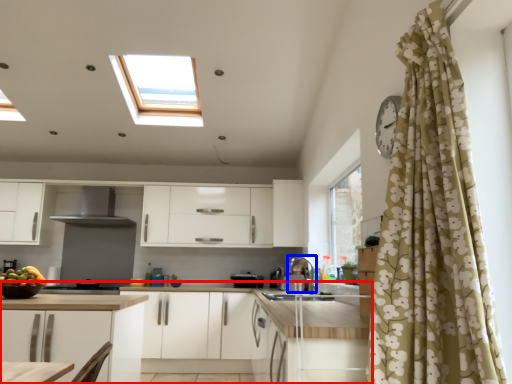
Question: Which object appears closest to the camera in this image, countertop (highlighted by a red box) or appliance (highlighted by a blue box)?

Choices:
 (A) countertop
 (B) appliance

Answer: (A)